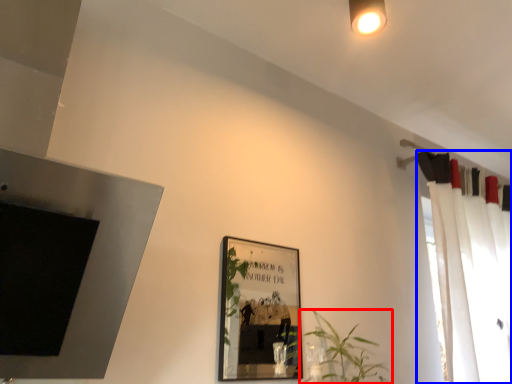
Question: Which point is further to the camera, houseplant (highlighted by a red box) or curtain (highlighted by a blue box)?

Choices:
 (A) houseplant
 (B) curtain

Answer: (B)